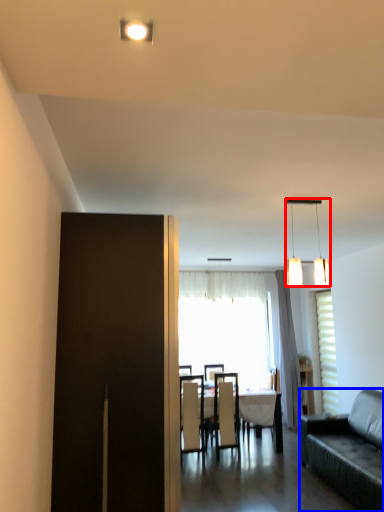
Question: Which of the following is the closest to the observer, lamp (highlighted by a red box) or studio couch (highlighted by a blue box)?

Choices:
 (A) lamp
 (B) studio couch

Answer: (A)